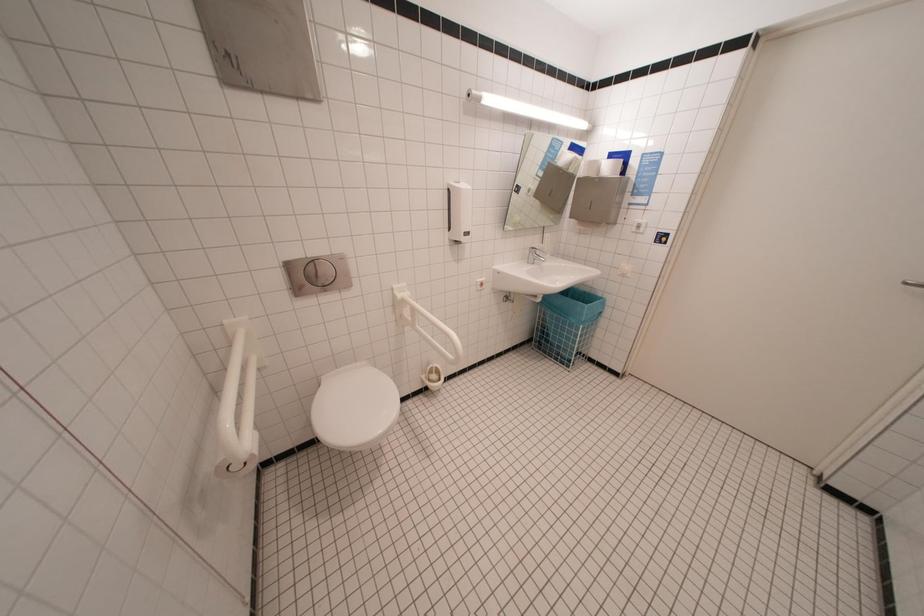
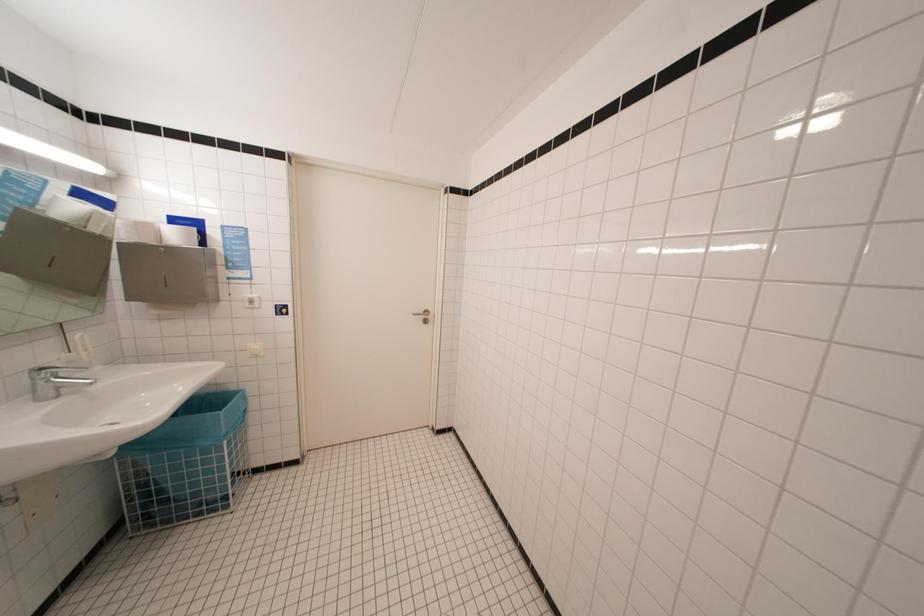
Question: Based on the continuous images, in which direction is the camera rotating? Reply with the corresponding letter.

Choices:
 (A) Left
 (B) Right
 (C) Up
 (D) Down

Answer: (B)